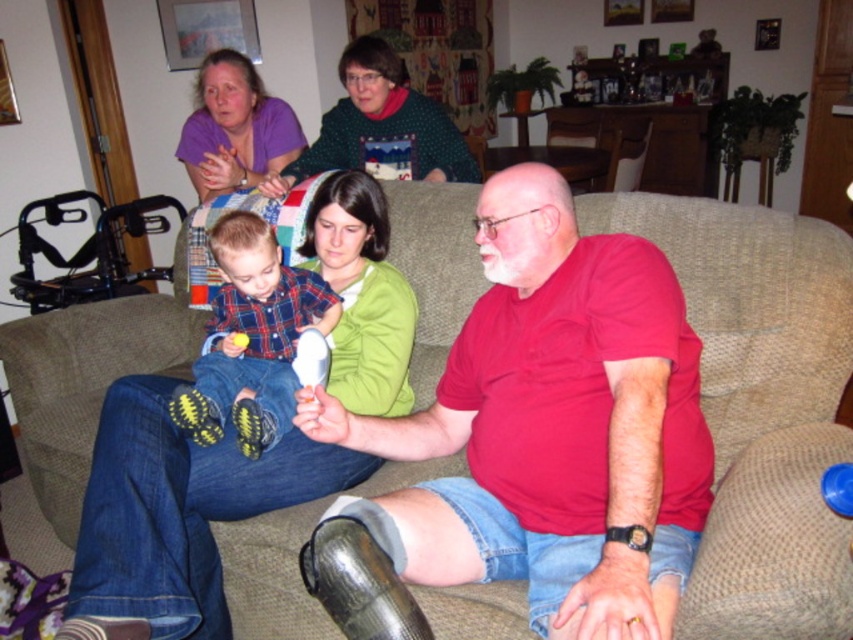
Based on the provided scene description, what are the coordinates of the red matte shirt at center?

The coordinates of the red matte shirt at center are at point (552, 428).

You are standing in the living room and want to hand a gift to the person wearing the red matte shirt at center. Based on their position, can you estimate whether they are seated closer to the left or right side of the couch?

The red matte shirt at center is located at point [552,428], which places them closer to the right side of the couch.

Based on the photo, you are designing a seating arrangement for a photo shoot and need to place two shirts on a table between the red matte shirt at center and the plaid fabric shirt at center. Which shirt should you place closer to the edge of the table to ensure they are both visible?

The red matte shirt at center should be placed closer to the edge of the table because it is larger in size than the plaid fabric shirt at center, making it easier to see from a distance.